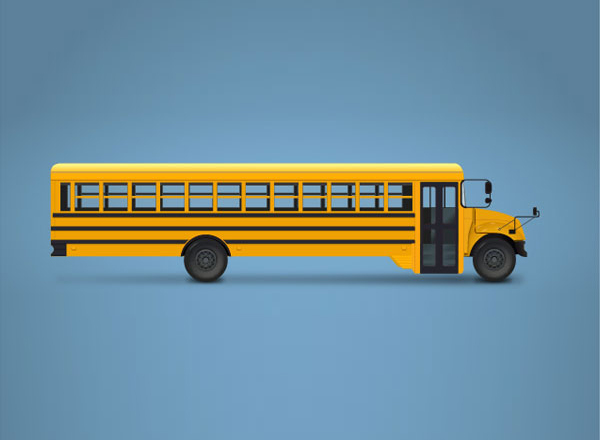
Locate an element on the screen. bottom right quadrant of door is located at coordinates (450, 254).